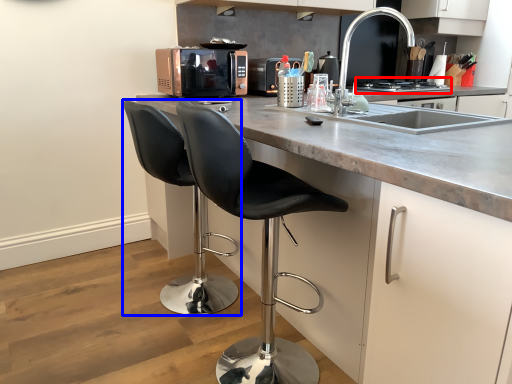
Question: Among these objects, which one is nearest to the camera, stove (highlighted by a red box) or chair (highlighted by a blue box)?

Choices:
 (A) stove
 (B) chair

Answer: (B)